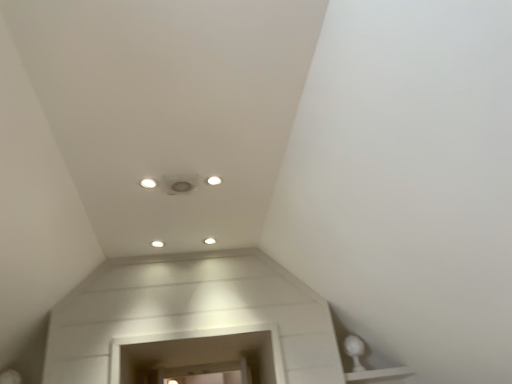
Question: Is white glossy light fixture at upper center, the second dot in the back-to-front sequence, wider or thinner than white glossy light fixture at center, which appears as the 1th dot when viewed from the right?

Choices:
 (A) wide
 (B) thin

Answer: (B)

Question: Based on their sizes in the image, would you say white glossy light fixture at upper center, placed as the 2th dot when sorted from bottom to top, is bigger or smaller than white glossy light fixture at center, which is the 2th dot from front to back?

Choices:
 (A) small
 (B) big

Answer: (A)

Question: Is white glossy light fixture at upper center, which is the 1th dot in left-to-right order, in front of or behind white glossy light fixture at center, arranged as the 2th dot when viewed from the top, in the image?

Choices:
 (A) front
 (B) behind

Answer: (A)

Question: In the image, is white glossy light fixture at center, which appears as the first dot when ordered from the bottom, on the left side or the right side of white glossy light fixture at upper center, placed as the 2th dot when sorted from bottom to top?

Choices:
 (A) left
 (B) right

Answer: (B)

Question: Based on their sizes in the image, would you say white glossy light fixture at center, which is the 2th dot from front to back, is bigger or smaller than white glossy light fixture at upper center, the second dot in the back-to-front sequence?

Choices:
 (A) small
 (B) big

Answer: (B)

Question: In terms of height, does white glossy light fixture at center, the 1th dot positioned from the back, look taller or shorter compared to white glossy light fixture at upper center, the 2th dot viewed from the right?

Choices:
 (A) tall
 (B) short

Answer: (A)

Question: Does point (204, 238) appear closer or farther from the camera than point (141, 183)?

Choices:
 (A) farther
 (B) closer

Answer: (A)